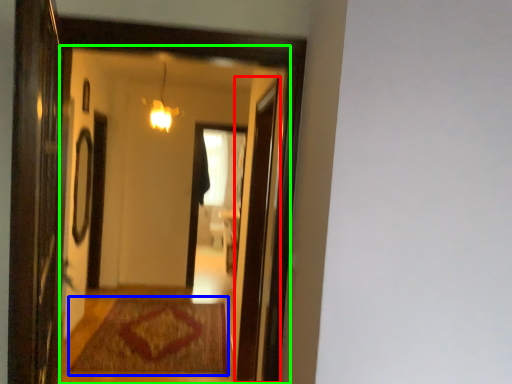
Question: Which object is the closest to the screen door (highlighted by a red box)? Choose among these: mat (highlighted by a blue box) or mirror (highlighted by a green box).

Choices:
 (A) mat
 (B) mirror

Answer: (A)